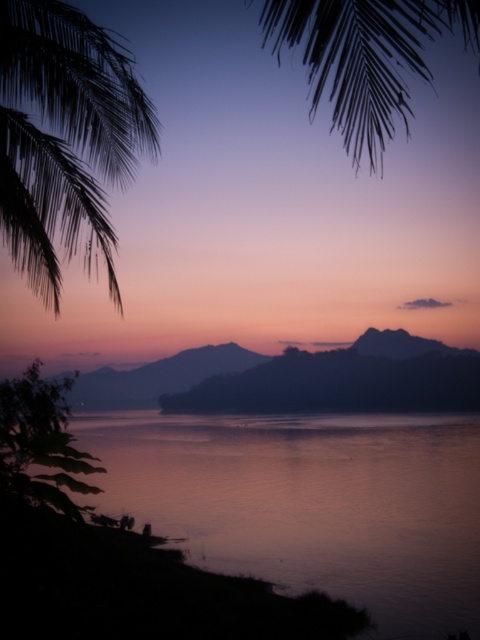
You are an artist trying to paint the sunset scene. You notice two silky black palm fronds at upper left and a silky black palm leaf at upper center. Which one is located to the left of the other?

The silky black palm fronds at upper left is positioned on the left side of silky black palm leaf at upper center.

You are standing at the edge of the water in the sunset scene. There is a point marked at coordinates (310,502), which is in the lower center of the image. Can you confirm if the area around this point has smooth water?

Yes, the area around point (310,502), which is marked as smooth water at lower center, has smooth water.

You are a photographer trying to capture the reflection of the palm fronds in the water. Based on the scene, will the silky black palm fronds at upper left be visible in the reflection of the smooth water at lower center?

The silky black palm fronds at upper left are behind the smooth water at lower center, so their reflection would appear in the water. Since the water is smooth, it can reflect the palm fronds, making them visible in the reflection.